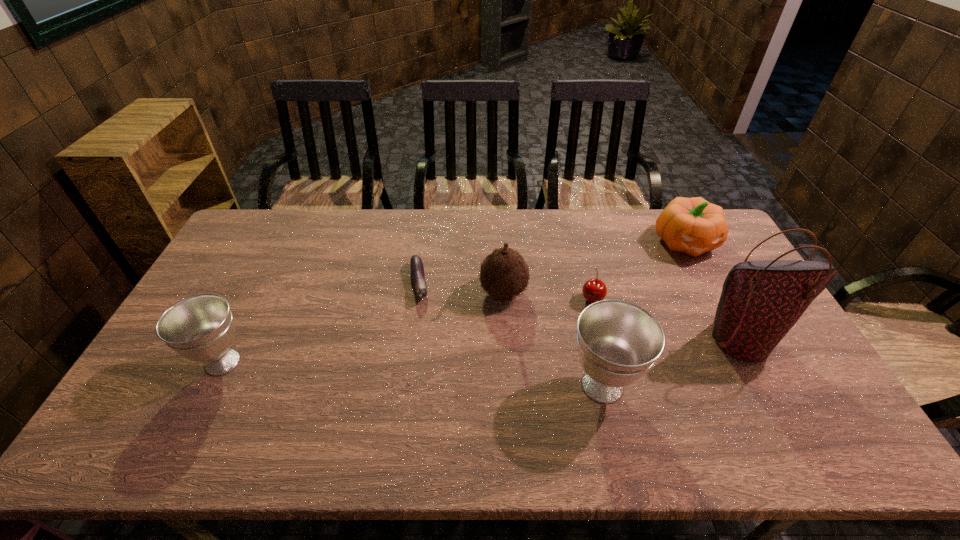
At what (x,y) coordinates should I click in order to perform the action: click on vacant point located 0.370m on the right of the taller chalice. Please return your answer as a coordinate pair (x, y). Looking at the image, I should click on (781, 386).

Find the location of a particular element. The width and height of the screenshot is (960, 540). vacant space located 0.090m on the carved face of the pumpkin is located at coordinates (707, 282).

Identify the location of blank space located 0.120m on the right of the sixth object from right to left. This screenshot has width=960, height=540. (467, 283).

Image resolution: width=960 pixels, height=540 pixels. I want to click on free space located 0.140m on the back of the handbag, so click(711, 284).

Image resolution: width=960 pixels, height=540 pixels. Find the location of `vacant area situated 0.250m on the surface of the third object from left to right`. vacant area situated 0.250m on the surface of the third object from left to right is located at coordinates (399, 292).

At what (x,y) coordinates should I click in order to perform the action: click on vacant space located on the surface of the third object from left to right. Please return your answer as a coordinate pair (x, y). The width and height of the screenshot is (960, 540). Looking at the image, I should click on (449, 292).

Find the location of `free location located on the surface of the third object from left to right`. free location located on the surface of the third object from left to right is located at coordinates (355, 292).

At what (x,y) coordinates should I click in order to perform the action: click on free space located 0.270m on the left of the cherry. Please return your answer as a coordinate pair (x, y). This screenshot has height=540, width=960. Looking at the image, I should click on (493, 298).

Identify the location of object that is at the far edge. The width and height of the screenshot is (960, 540). (694, 226).

The height and width of the screenshot is (540, 960). What are the coordinates of `object that is positioned at the left edge` in the screenshot? It's located at (200, 328).